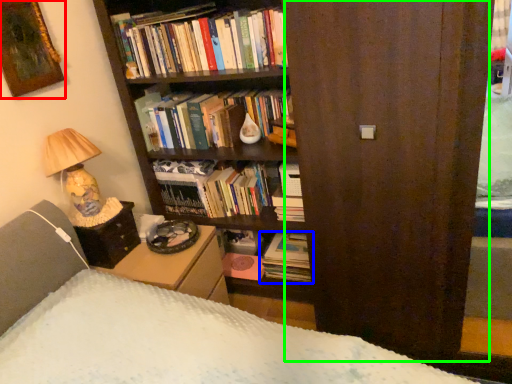
Question: Which object is positioned farthest from picture frame (highlighted by a red box)? Select from book (highlighted by a blue box) and screen door (highlighted by a green box).

Choices:
 (A) book
 (B) screen door

Answer: (A)